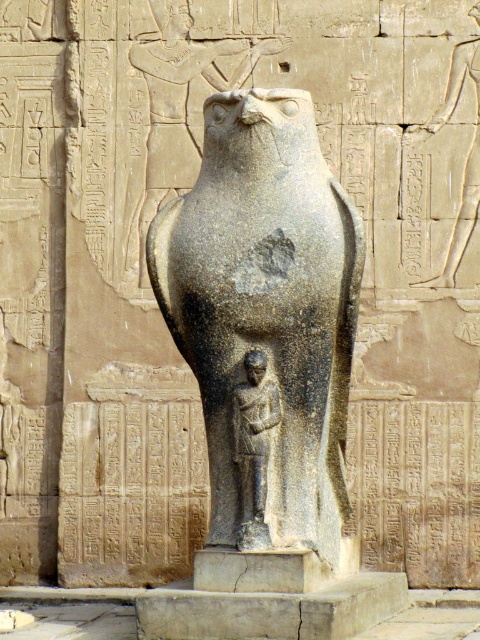
Which is in front, point (222, 538) or point (264, 538)?

Positioned in front is point (264, 538).

I want to click on granite statue of falcon at center, so click(x=265, y=317).

The height and width of the screenshot is (640, 480). In order to click on granite statue of falcon at center in this screenshot , I will do `click(265, 317)`.